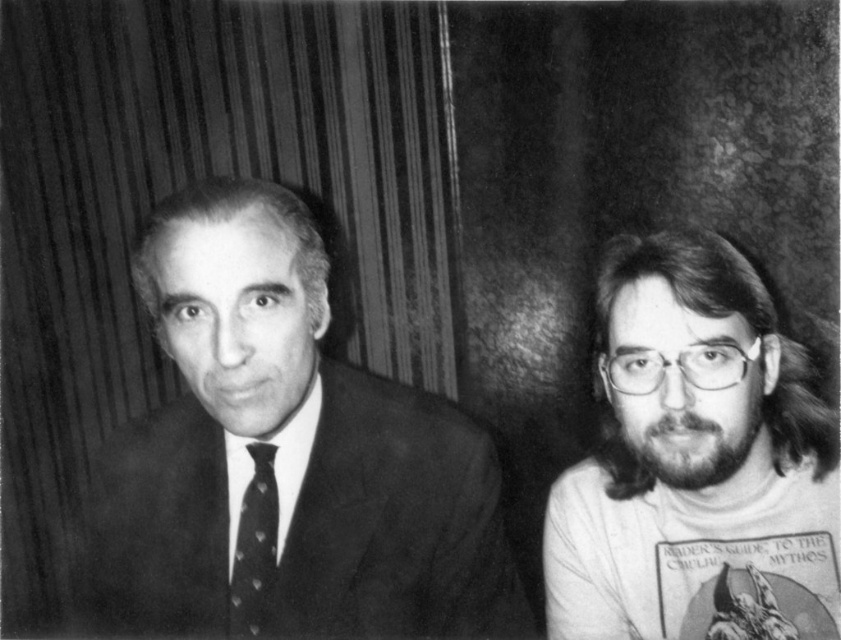
Does smooth black suit at left have a larger size compared to polka dot silk tie at left?

Yes.

Is smooth black suit at left to the left of polka dot silk tie at left from the viewer's perspective?

No, smooth black suit at left is not to the left of polka dot silk tie at left.

Between point (302, 545) and point (262, 458), which one is positioned in front?

Positioned in front is point (302, 545).

The height and width of the screenshot is (640, 841). Identify the location of smooth black suit at left. (288, 451).

Can you confirm if smooth black suit at left is shorter than bearded man with glasses at right?

In fact, smooth black suit at left may be taller than bearded man with glasses at right.

Based on the photo, which is more to the left, smooth black suit at left or bearded man with glasses at right?

From the viewer's perspective, smooth black suit at left appears more on the left side.

The image size is (841, 640). What do you see at coordinates (288, 451) in the screenshot?
I see `smooth black suit at left` at bounding box center [288, 451].

The width and height of the screenshot is (841, 640). I want to click on smooth black suit at left, so click(288, 451).

Is bearded man with glasses at right taller than polka dot silk tie at left?

Indeed, bearded man with glasses at right has a greater height compared to polka dot silk tie at left.

From the picture: Does bearded man with glasses at right have a lesser height compared to polka dot silk tie at left?

Incorrect, bearded man with glasses at right's height does not fall short of polka dot silk tie at left's.

I want to click on bearded man with glasses at right, so click(696, 461).